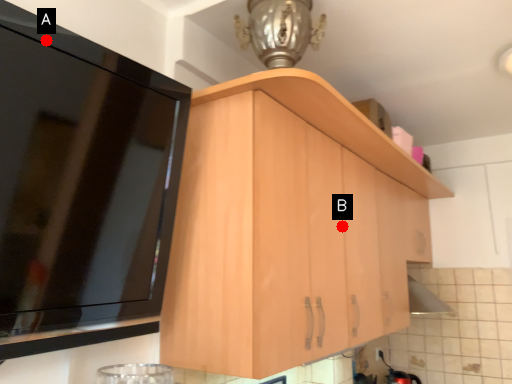
Question: Two points are circled on the image, labeled by A and B beside each circle. Among these points, which one is nearest to the camera?

Choices:
 (A) A is closer
 (B) B is closer

Answer: (A)